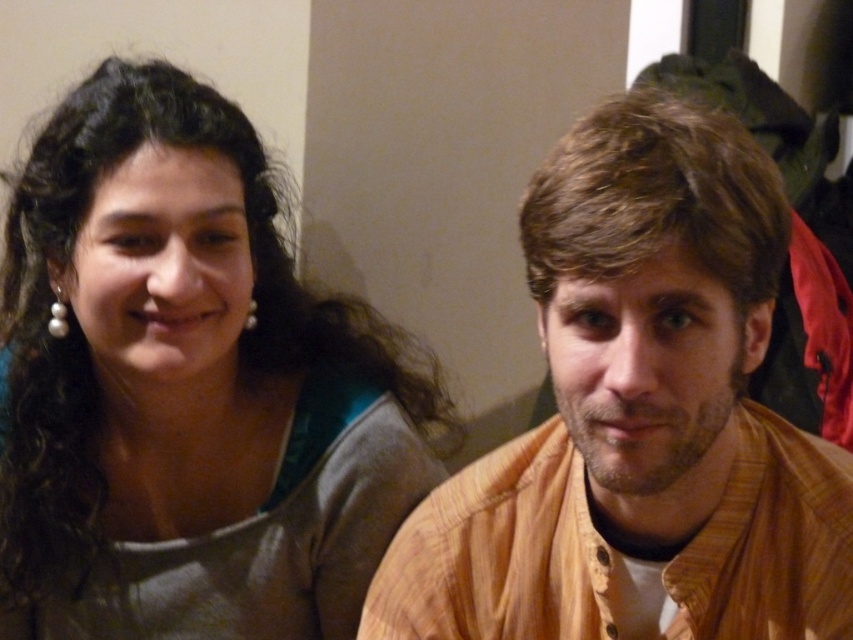
You are a photographer setting up a shoot in this room. You need to ensure that the matte green dress at left is visible without being blocked by the pearl earring at left. Based on the scene description, is this possible?

The matte green dress at left is in front of the pearl earring at left, so it is already visible without being blocked.

You are a photographer adjusting the lighting in the room. You notice the pearl earring at left and the pearlearring at upper left. Which pearl earring is located to the left of the other?

The pearl earring at left is positioned on the left side of pearlearring at upper left, so the pearl earring at left is to the left of the pearlearring at upper left.

You are an artist trying to draw the scene. You notice two pearl earring at left and pearlearring at upper left. Which one is larger?

The pearlearring at upper left is larger than the pearl earring at left.